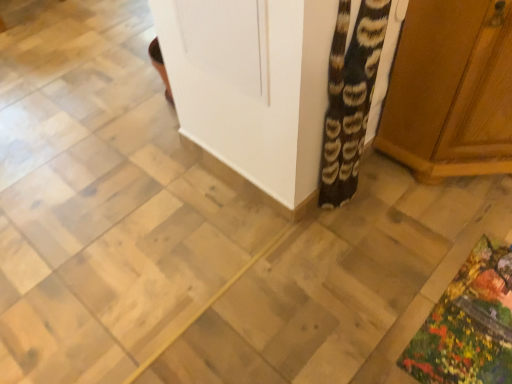
Question: In which direction should I rotate to look at black and white patterned blanket at center?

Choices:
 (A) right
 (B) left

Answer: (A)